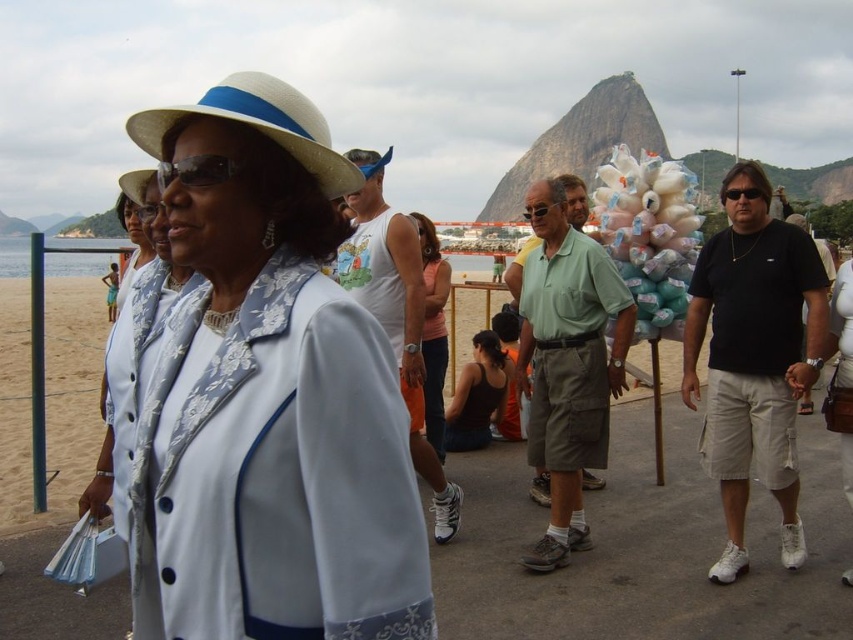
Question: Which object appears farthest from the camera in this image?

Choices:
 (A) white tank top at center
 (B) black cotton shirt at center
 (C) green cotton shirt at center
 (D) orange fabric tank top at center

Answer: (D)

Question: Is matte white hat at upper left in front of green cotton shirt at center?

Choices:
 (A) no
 (B) yes

Answer: (B)

Question: Does matte white hat at upper left have a smaller size compared to black cotton shirt at center?

Choices:
 (A) yes
 (B) no

Answer: (A)

Question: Which object appears farthest from the camera in this image?

Choices:
 (A) orange fabric tank top at center
 (B) black cotton shirt at center
 (C) white straw hat at upper left

Answer: (A)

Question: Where is black cotton shirt at center located in relation to white tank top at center in the image?

Choices:
 (A) above
 (B) below

Answer: (B)

Question: Which object appears closest to the camera in this image?

Choices:
 (A) matte white hat at upper left
 (B) black cotton shirt at center
 (C) white fabric at center

Answer: (A)